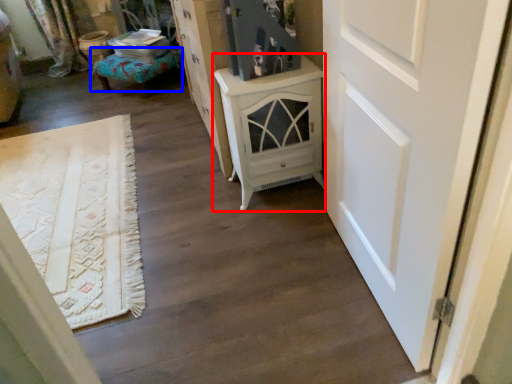
Question: Which object is further to the camera taking this photo, chest of drawers (highlighted by a red box) or furniture (highlighted by a blue box)?

Choices:
 (A) chest of drawers
 (B) furniture

Answer: (B)